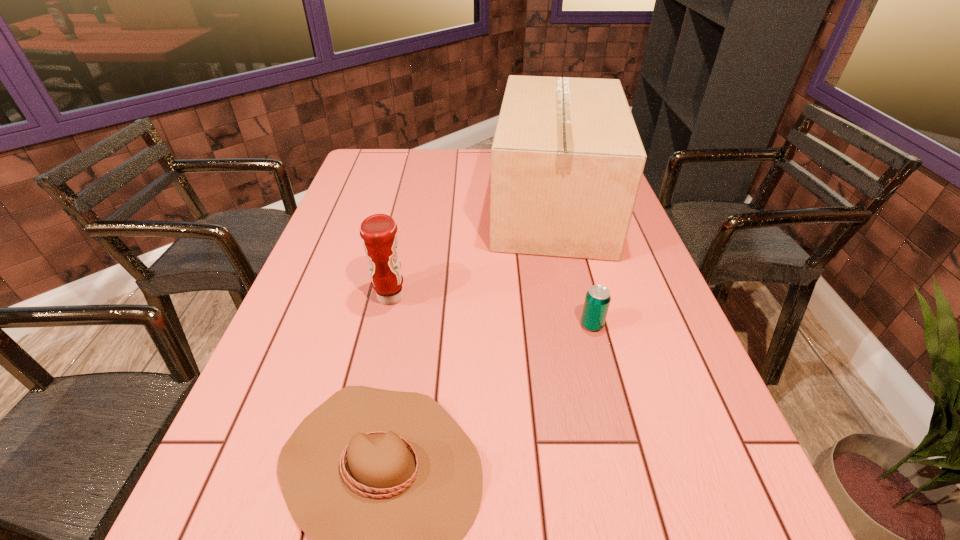
Identify the location of object present at the right edge. (567, 160).

Where is `object at the far right corner`? The width and height of the screenshot is (960, 540). object at the far right corner is located at coordinates (567, 160).

Where is `free space at the far edge of the desktop`? The height and width of the screenshot is (540, 960). free space at the far edge of the desktop is located at coordinates (415, 165).

Locate an element on the screen. Image resolution: width=960 pixels, height=540 pixels. free space at the near edge of the desktop is located at coordinates (609, 539).

The width and height of the screenshot is (960, 540). I want to click on free space at the left edge of the desktop, so click(x=253, y=480).

Find the location of a particular element. free space at the right edge is located at coordinates [666, 300].

I want to click on vacant space that's between the beer can and the box, so click(573, 265).

The image size is (960, 540). What are the coordinates of `free spot between the second tallest object and the second shortest object` in the screenshot? It's located at (492, 311).

This screenshot has height=540, width=960. In order to click on free point between the condiment and the box in this screenshot , I will do `click(472, 251)`.

Locate an element on the screen. free space between the box and the beer can is located at coordinates (573, 265).